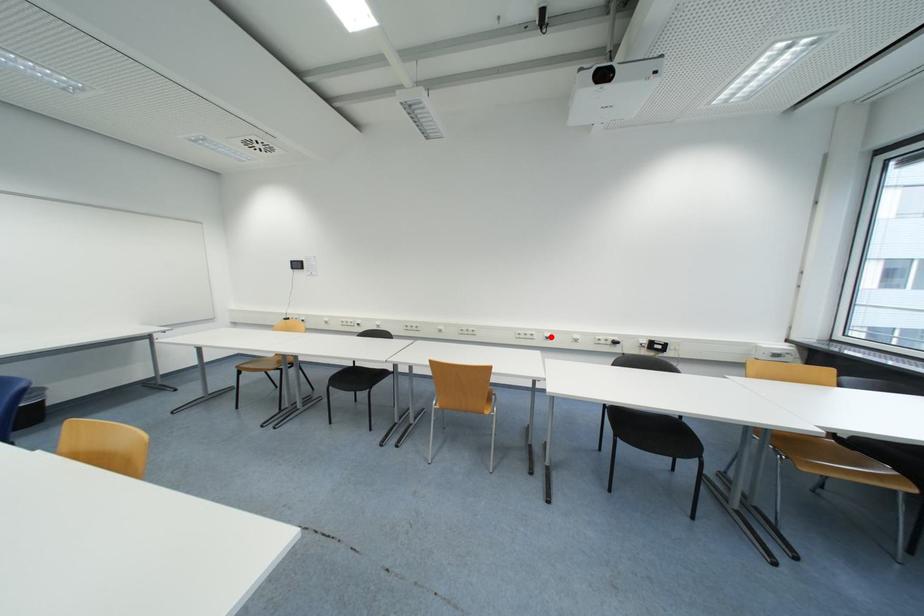
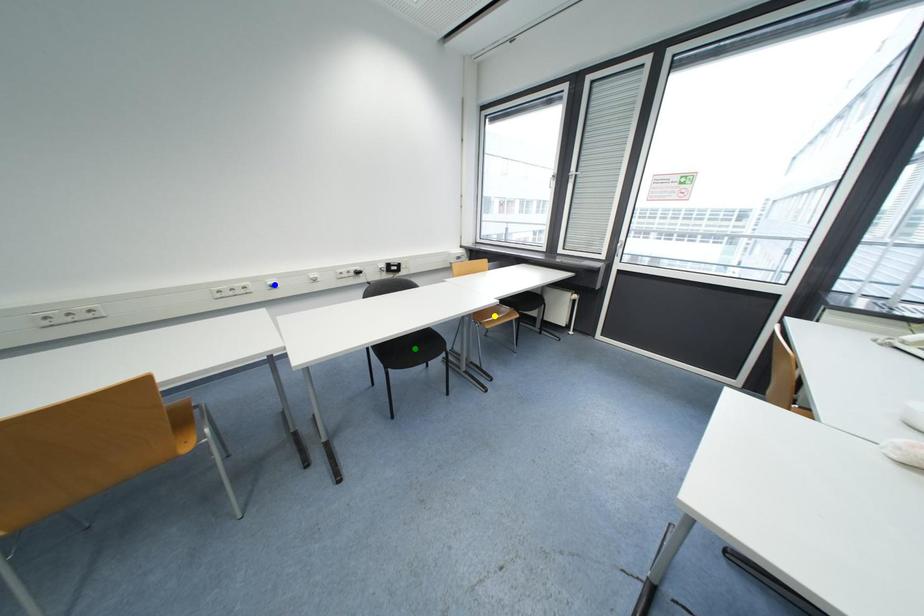
Question: I am providing you with two images of the same scene from different viewpoints. A red point is marked on the first image. You are given multiple points on the second image. Which mark in image 2 goes with the point in image 1?

Choices:
 (A) green point
 (B) yellow point
 (C) blue point

Answer: (C)